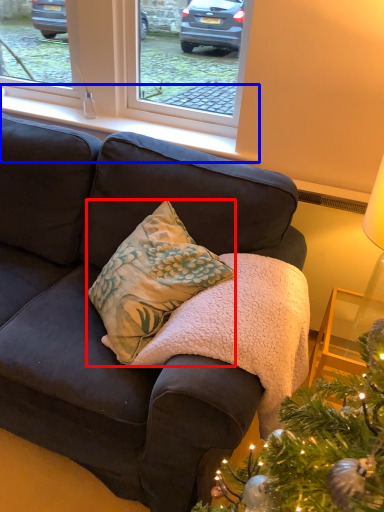
Question: Which of the following is the closest to the observer, pillow (highlighted by a red box) or window sill (highlighted by a blue box)?

Choices:
 (A) pillow
 (B) window sill

Answer: (A)